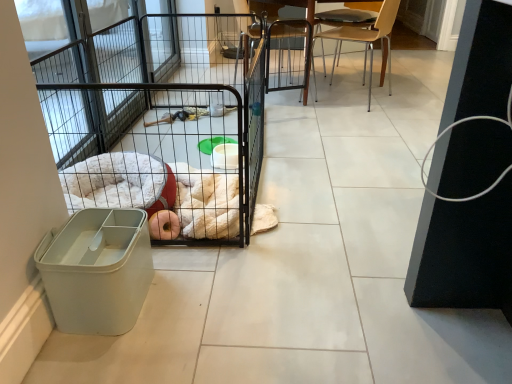
What do you see at coordinates (288, 55) in the screenshot? This screenshot has width=512, height=384. I see `wooden chair at center, arranged as the 2th chair when viewed from the right` at bounding box center [288, 55].

The width and height of the screenshot is (512, 384). What are the coordinates of `light brown wooden chair at upper right, which appears as the second chair when viewed from the left` in the screenshot? It's located at (368, 40).

Image resolution: width=512 pixels, height=384 pixels. Find the location of `cage that appears in front of the light brown wooden chair at upper right, the 1th chair when ordered from right to left`. cage that appears in front of the light brown wooden chair at upper right, the 1th chair when ordered from right to left is located at coordinates (163, 150).

Is black wire cage at center completely or partially outside of light brown wooden chair at upper right, the 1th chair when ordered from right to left?

Yes.

Which is more to the right, black wire cage at center or light brown wooden chair at upper right, which appears as the second chair when viewed from the left?

light brown wooden chair at upper right, which appears as the second chair when viewed from the left, is more to the right.

How different are the orientations of black wire cage at center and light brown wooden chair at upper right, which appears as the second chair when viewed from the left, in degrees?

They differ by 148 degrees in their facing directions.

Is light brown wooden chair at upper right, which appears as the second chair when viewed from the left, taller or shorter than black wire cage at center?

Clearly, light brown wooden chair at upper right, which appears as the second chair when viewed from the left, is taller compared to black wire cage at center.

Considering the sizes of objects light brown wooden chair at upper right, the 1th chair when ordered from right to left, and black wire cage at center in the image provided, who is thinner, light brown wooden chair at upper right, the 1th chair when ordered from right to left, or black wire cage at center?

light brown wooden chair at upper right, the 1th chair when ordered from right to left.

Which object is closer to the camera, light brown wooden chair at upper right, the 1th chair when ordered from right to left, or black wire cage at center?

black wire cage at center is closer to the camera.

Based on the photo, is light brown wooden chair at upper right, the 1th chair when ordered from right to left, situated inside black wire cage at center or outside?

light brown wooden chair at upper right, the 1th chair when ordered from right to left, exists outside the volume of black wire cage at center.

Is wooden chair at center, which appears as the first chair when viewed from the left, wider or thinner than light brown wooden chair at upper right, which appears as the second chair when viewed from the left?

wooden chair at center, which appears as the first chair when viewed from the left, is wider than light brown wooden chair at upper right, which appears as the second chair when viewed from the left.

Considering the sizes of objects wooden chair at center, which appears as the first chair when viewed from the left, and light brown wooden chair at upper right, the 1th chair when ordered from right to left, in the image provided, who is taller, wooden chair at center, which appears as the first chair when viewed from the left, or light brown wooden chair at upper right, the 1th chair when ordered from right to left,?

wooden chair at center, which appears as the first chair when viewed from the left, is taller.

Do you think wooden chair at center, arranged as the 2th chair when viewed from the right, is within light brown wooden chair at upper right, the 1th chair when ordered from right to left, or outside of it?

wooden chair at center, arranged as the 2th chair when viewed from the right, is not enclosed by light brown wooden chair at upper right, the 1th chair when ordered from right to left.

Based on the photo, can you tell me how much wooden chair at center, which appears as the first chair when viewed from the left, and light brown wooden chair at upper right, which appears as the second chair when viewed from the left, differ in facing direction?

The angle between the facing direction of wooden chair at center, which appears as the first chair when viewed from the left, and the facing direction of light brown wooden chair at upper right, which appears as the second chair when viewed from the left, is 131 degrees.

Is black wire cage at center aimed at wooden chair at center, which appears as the first chair when viewed from the left?

No, black wire cage at center does not turn towards wooden chair at center, which appears as the first chair when viewed from the left.

Are black wire cage at center and wooden chair at center, arranged as the 2th chair when viewed from the right, located far from each other?

black wire cage at center is far away from wooden chair at center, arranged as the 2th chair when viewed from the right.

This screenshot has width=512, height=384. What are the coordinates of `cage below the wooden chair at center, arranged as the 2th chair when viewed from the right (from a real-world perspective)` in the screenshot? It's located at (163, 150).

Which object is thinner, black wire cage at center or wooden chair at center, arranged as the 2th chair when viewed from the right?

wooden chair at center, arranged as the 2th chair when viewed from the right.

From the image's perspective, is light brown wooden chair at upper right, which appears as the second chair when viewed from the left, on top of wooden chair at center, arranged as the 2th chair when viewed from the right?

No, from the image's perspective, light brown wooden chair at upper right, which appears as the second chair when viewed from the left, is not above wooden chair at center, arranged as the 2th chair when viewed from the right.

Looking at this image, would you say light brown wooden chair at upper right, the 1th chair when ordered from right to left, is inside or outside wooden chair at center, which appears as the first chair when viewed from the left?

light brown wooden chair at upper right, the 1th chair when ordered from right to left, is outside wooden chair at center, which appears as the first chair when viewed from the left.

Considering the sizes of light brown wooden chair at upper right, which appears as the second chair when viewed from the left, and wooden chair at center, which appears as the first chair when viewed from the left, in the image, is light brown wooden chair at upper right, which appears as the second chair when viewed from the left, wider or thinner than wooden chair at center, which appears as the first chair when viewed from the left,?

In the image, light brown wooden chair at upper right, which appears as the second chair when viewed from the left, appears to be more narrow than wooden chair at center, which appears as the first chair when viewed from the left.

Is light brown wooden chair at upper right, which appears as the second chair when viewed from the left, not near wooden chair at center, which appears as the first chair when viewed from the left?

light brown wooden chair at upper right, which appears as the second chair when viewed from the left, is near wooden chair at center, which appears as the first chair when viewed from the left, not far away.

Where is `cage below the wooden chair at center, arranged as the 2th chair when viewed from the right (from a real-world perspective)`? This screenshot has height=384, width=512. cage below the wooden chair at center, arranged as the 2th chair when viewed from the right (from a real-world perspective) is located at coordinates (163, 150).

Considering the relative sizes of wooden chair at center, which appears as the first chair when viewed from the left, and black wire cage at center in the image provided, is wooden chair at center, which appears as the first chair when viewed from the left, smaller than black wire cage at center?

Yes, wooden chair at center, which appears as the first chair when viewed from the left, is smaller than black wire cage at center.

From the picture: From a real-world perspective, between wooden chair at center, which appears as the first chair when viewed from the left, and black wire cage at center, who is vertically higher?

From a 3D spatial view, wooden chair at center, which appears as the first chair when viewed from the left, is above.

How different are the orientations of wooden chair at center, arranged as the 2th chair when viewed from the right, and black wire cage at center in degrees?

There is a 16.8-degree angle between the facing directions of wooden chair at center, arranged as the 2th chair when viewed from the right, and black wire cage at center.

Locate an element on the screen. The height and width of the screenshot is (384, 512). the 2nd chair positioned above the black wire cage at center (from a real-world perspective) is located at coordinates (368, 40).

Locate an element on the screen. The width and height of the screenshot is (512, 384). the 2nd chair counting from the right side of the black wire cage at center is located at coordinates (368, 40).

Considering their positions, is light brown wooden chair at upper right, which appears as the second chair when viewed from the left, positioned further to black wire cage at center than wooden chair at center, arranged as the 2th chair when viewed from the right?

Among the two, light brown wooden chair at upper right, which appears as the second chair when viewed from the left, is located further to black wire cage at center.

Looking at the image, which one is located further to wooden chair at center, which appears as the first chair when viewed from the left, light brown wooden chair at upper right, the 1th chair when ordered from right to left, or black wire cage at center?

Among the two, black wire cage at center is located further to wooden chair at center, which appears as the first chair when viewed from the left.

Which object lies further to the anchor point light brown wooden chair at upper right, which appears as the second chair when viewed from the left, black wire cage at center or wooden chair at center, which appears as the first chair when viewed from the left?

black wire cage at center is positioned further to the anchor light brown wooden chair at upper right, which appears as the second chair when viewed from the left.

Which object lies nearer to the anchor point light brown wooden chair at upper right, the 1th chair when ordered from right to left, wooden chair at center, arranged as the 2th chair when viewed from the right, or black wire cage at center?

The object closer to light brown wooden chair at upper right, the 1th chair when ordered from right to left, is wooden chair at center, arranged as the 2th chair when viewed from the right.

From the image, which object appears to be nearer to wooden chair at center, arranged as the 2th chair when viewed from the right, black wire cage at center or light brown wooden chair at upper right, the 1th chair when ordered from right to left?

Based on the image, light brown wooden chair at upper right, the 1th chair when ordered from right to left, appears to be nearer to wooden chair at center, arranged as the 2th chair when viewed from the right.

Based on their spatial positions, is wooden chair at center, arranged as the 2th chair when viewed from the right, or light brown wooden chair at upper right, which appears as the second chair when viewed from the left, closer to black wire cage at center?

Among the two, wooden chair at center, arranged as the 2th chair when viewed from the right, is located nearer to black wire cage at center.

Where is `chair located between black wire cage at center and wooden chair at center, arranged as the 2th chair when viewed from the right, in the depth direction`? The width and height of the screenshot is (512, 384). chair located between black wire cage at center and wooden chair at center, arranged as the 2th chair when viewed from the right, in the depth direction is located at coordinates (368, 40).